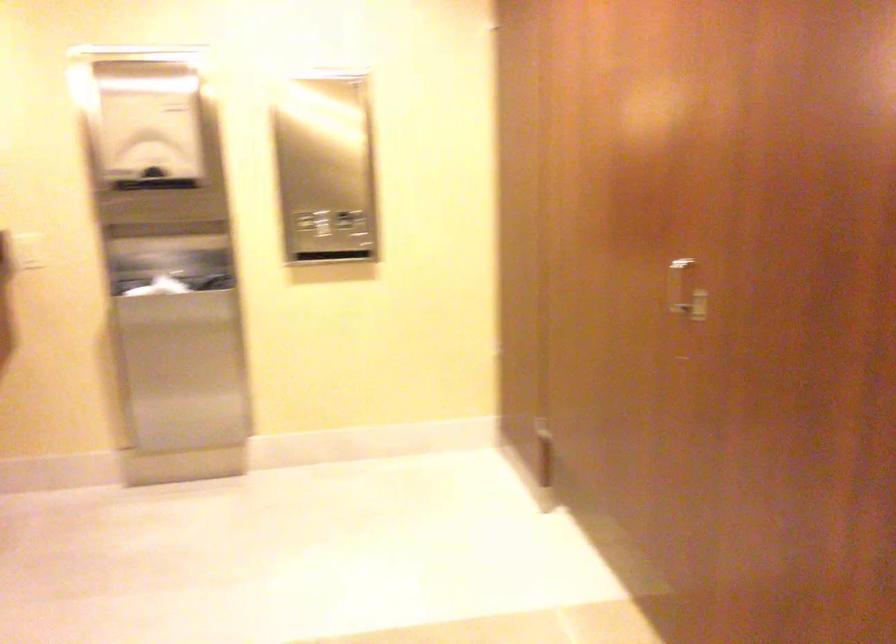
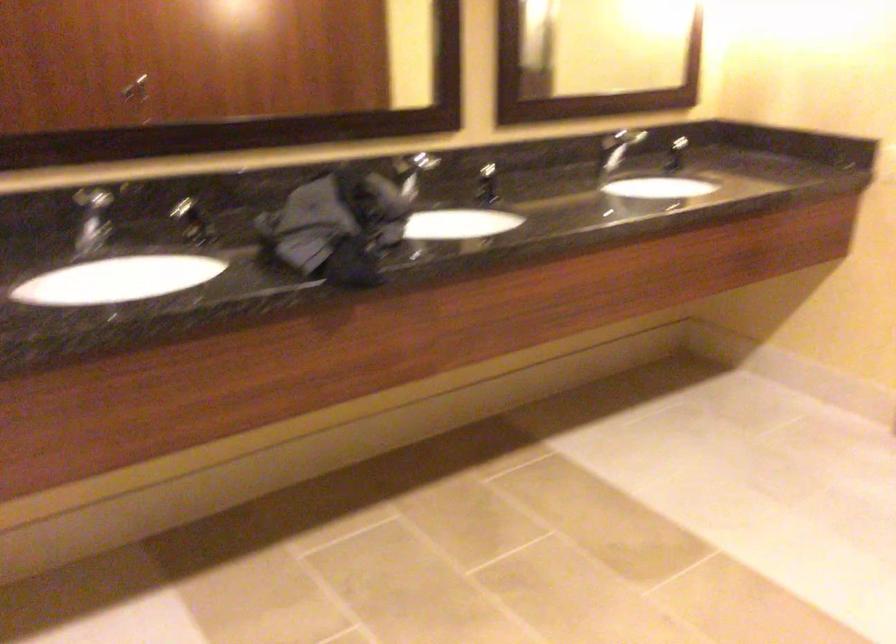
Question: How did the camera likely rotate?

Choices:
 (A) Left
 (B) Right
 (C) Up
 (D) Down

Answer: (A)